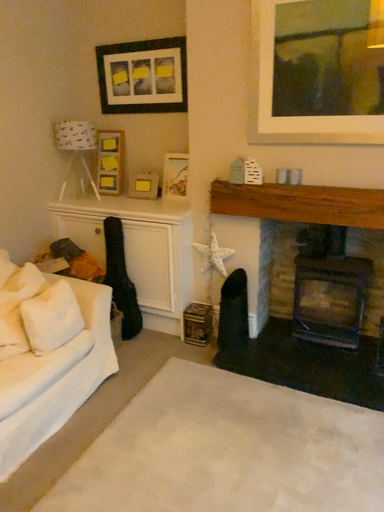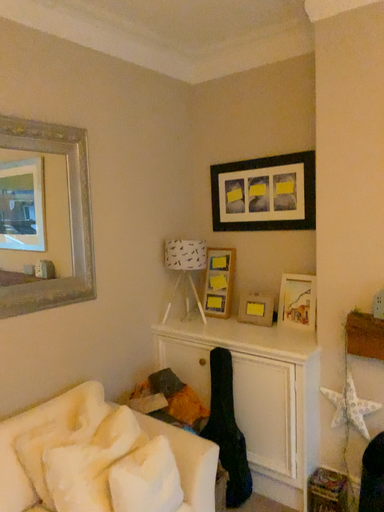
Question: Which way did the camera rotate in the video?

Choices:
 (A) rotated left
 (B) rotated right

Answer: (A)